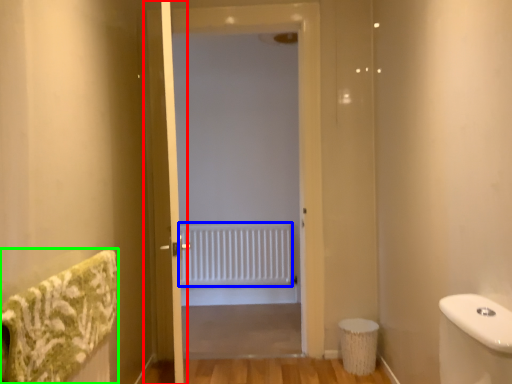
Question: Which object is the farthest from screen door (highlighted by a red box)? Choose among these: radiator (highlighted by a blue box) or bath towel (highlighted by a green box).

Choices:
 (A) radiator
 (B) bath towel

Answer: (A)